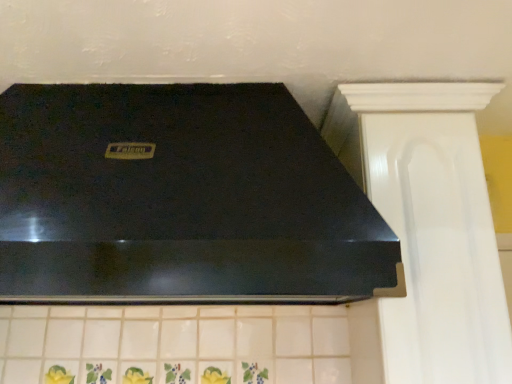
Locate an element on the screen. This screenshot has height=384, width=512. black glossy range hood at upper center is located at coordinates (181, 200).

This screenshot has height=384, width=512. What do you see at coordinates (181, 200) in the screenshot?
I see `black glossy range hood at upper center` at bounding box center [181, 200].

The width and height of the screenshot is (512, 384). Identify the location of black glossy range hood at upper center. (181, 200).